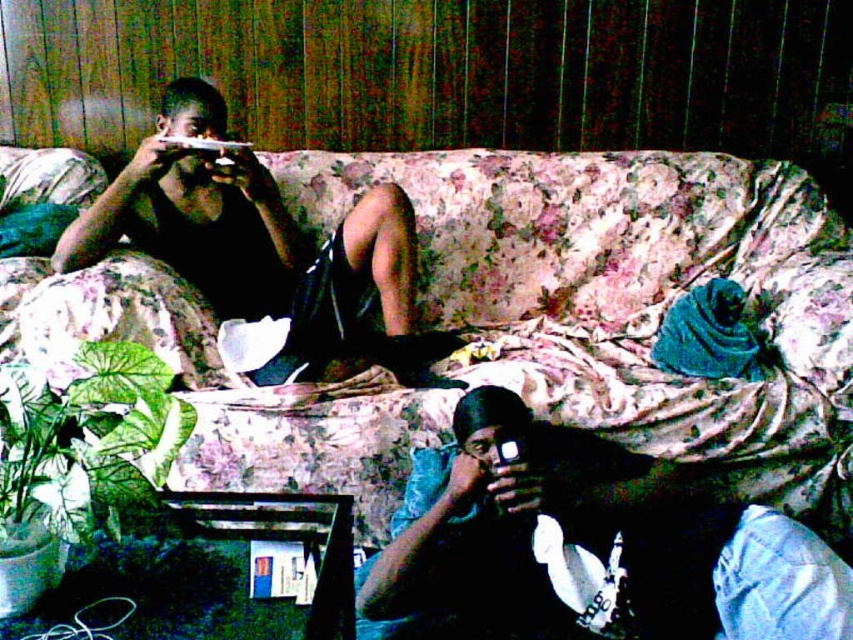
Question: Can you confirm if matte black phone at center is positioned below matte black phone at upper left?

Choices:
 (A) yes
 (B) no

Answer: (A)

Question: Which object appears closest to the camera in this image?

Choices:
 (A) matte black phone at upper left
 (B) matte black phone at center

Answer: (B)

Question: Which point is farther to the camera?

Choices:
 (A) matte black phone at upper left
 (B) matte black phone at center

Answer: (A)

Question: Is matte black phone at center above matte black phone at upper left?

Choices:
 (A) yes
 (B) no

Answer: (B)

Question: Can you confirm if matte black phone at center is positioned below matte black phone at upper left?

Choices:
 (A) yes
 (B) no

Answer: (A)

Question: Which object is farther from the camera taking this photo?

Choices:
 (A) matte black phone at center
 (B) matte black phone at upper left

Answer: (B)